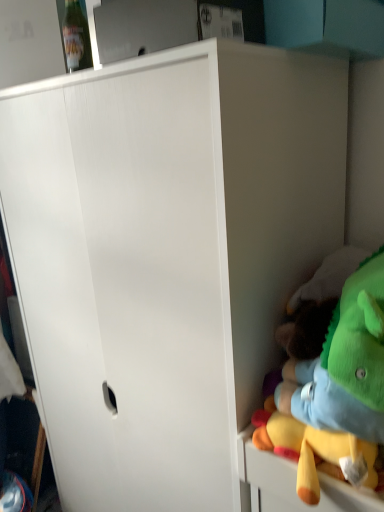
Question: From a real-world perspective, is soft plush toy at right below transparent plastic bottle at upper left?

Choices:
 (A) no
 (B) yes

Answer: (B)

Question: Does soft plush toy at right have a smaller size compared to transparent plastic bottle at upper left?

Choices:
 (A) no
 (B) yes

Answer: (A)

Question: Considering the relative positions of soft plush toy at right and transparent plastic bottle at upper left in the image provided, is soft plush toy at right to the right of transparent plastic bottle at upper left from the viewer's perspective?

Choices:
 (A) no
 (B) yes

Answer: (B)

Question: Considering the relative sizes of soft plush toy at right and transparent plastic bottle at upper left in the image provided, is soft plush toy at right shorter than transparent plastic bottle at upper left?

Choices:
 (A) yes
 (B) no

Answer: (B)

Question: Is transparent plastic bottle at upper left inside soft plush toy at right?

Choices:
 (A) yes
 (B) no

Answer: (B)

Question: Is soft plush toy at right placed right next to transparent plastic bottle at upper left?

Choices:
 (A) no
 (B) yes

Answer: (A)

Question: From the image's perspective, would you say transparent plastic bottle at upper left is positioned over soft plush toy at right?

Choices:
 (A) no
 (B) yes

Answer: (B)

Question: Does transparent plastic bottle at upper left appear on the left side of soft plush toy at right?

Choices:
 (A) yes
 (B) no

Answer: (A)

Question: Can you confirm if transparent plastic bottle at upper left is wider than soft plush toy at right?

Choices:
 (A) yes
 (B) no

Answer: (B)

Question: Can you confirm if transparent plastic bottle at upper left is smaller than soft plush toy at right?

Choices:
 (A) no
 (B) yes

Answer: (B)

Question: From a real-world perspective, is transparent plastic bottle at upper left below soft plush toy at right?

Choices:
 (A) yes
 (B) no

Answer: (B)

Question: From a real-world perspective, is transparent plastic bottle at upper left over soft plush toy at right?

Choices:
 (A) no
 (B) yes

Answer: (B)

Question: Considering the positions of point (66, 8) and point (258, 446), is point (66, 8) closer or farther from the camera than point (258, 446)?

Choices:
 (A) farther
 (B) closer

Answer: (A)